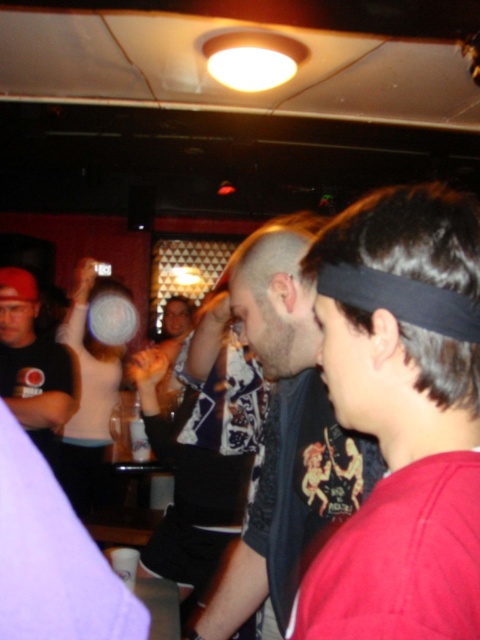
Can you confirm if dark gray t-shirt at center is thinner than matte black t-shirt at left?

Correct, dark gray t-shirt at center's width is less than matte black t-shirt at left's.

Between dark gray t-shirt at center and matte black t-shirt at left, which one has less height?

With less height is matte black t-shirt at left.

At what (x,y) coordinates should I click in order to perform the action: click on dark gray t-shirt at center. Please return your answer as a coordinate pair (x, y). This screenshot has width=480, height=640. Looking at the image, I should click on (285, 433).